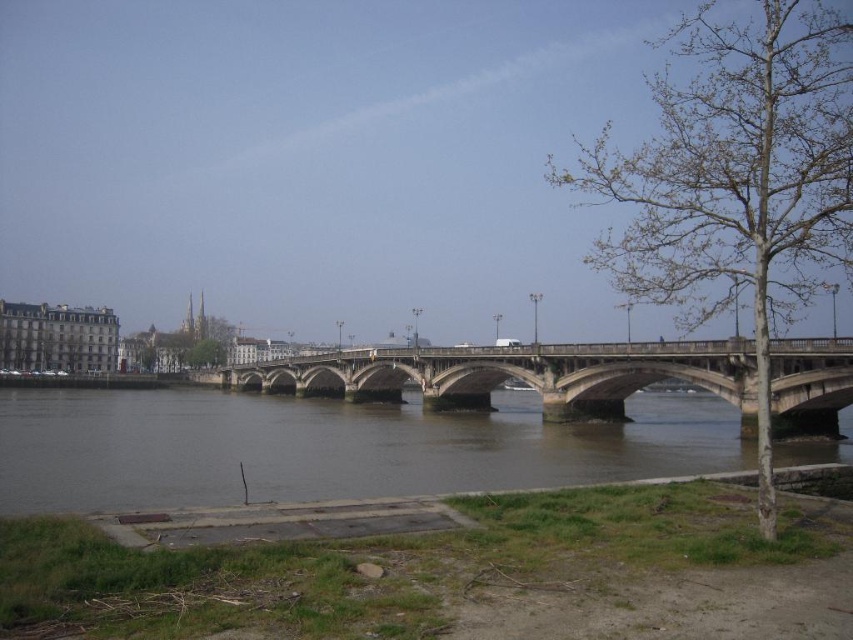
Consider the image. You are a park ranger planning to plant a new tree that requires at least 300 feet of space between it and the nearest tree to ensure proper growth. You have two existing trees in the area, the bare wood tree at right and the green leafy tree at center. Can you plant the new tree between them without violating the spacing requirement?

The distance between the bare wood tree at right and the green leafy tree at center is 372.95 feet, which is greater than the required 300 feet. Therefore, planting the new tree between them would satisfy the spacing requirement as long as it stays within this distance.

You are standing on the riverside path and see the brown muddy water at lower center and the green leafy tree at center. Which object is closer to the ground?

The brown muddy water at lower center is located below green leafy tree at center, so it is closer to the ground.